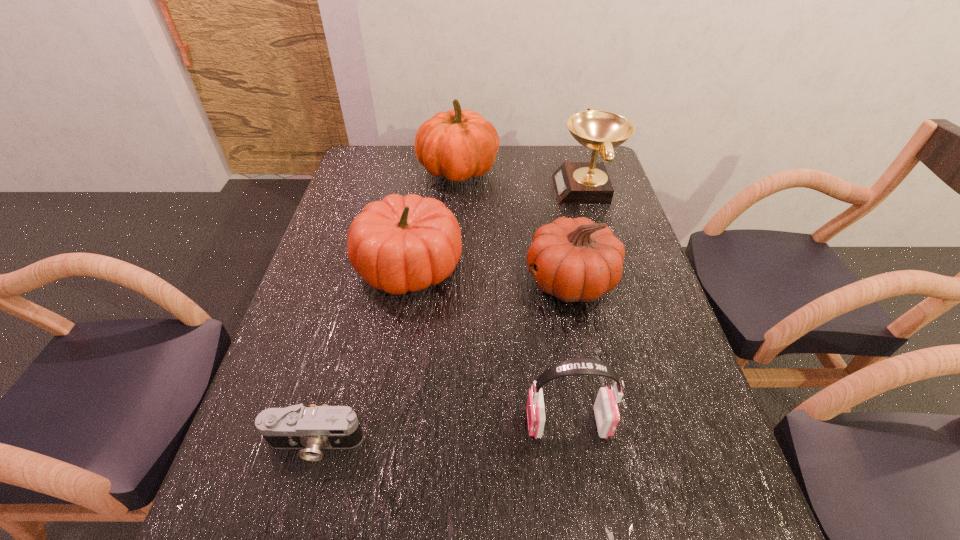
Find the location of a particular element. Image resolution: width=960 pixels, height=540 pixels. the tallest pumpkin is located at coordinates (456, 144).

Locate an element on the screen. This screenshot has width=960, height=540. award is located at coordinates (575, 182).

Find the location of a particular element. The image size is (960, 540). earphone is located at coordinates (607, 416).

Find the location of a particular element. the rightmost pumpkin is located at coordinates (579, 260).

The height and width of the screenshot is (540, 960). In order to click on camera in this screenshot , I will do `click(313, 428)`.

Where is `vacant position located 0.310m on the front of the farthest pumpkin`? vacant position located 0.310m on the front of the farthest pumpkin is located at coordinates (452, 258).

This screenshot has height=540, width=960. I want to click on blank area located 0.200m on the front-facing side of the award, so point(495,190).

Find the location of a particular element. vacant space situated on the front-facing side of the award is located at coordinates (439, 190).

Identify the location of free spot located on the front-facing side of the award. Image resolution: width=960 pixels, height=540 pixels. (477, 190).

At what (x,y) coordinates should I click in order to perform the action: click on free region located 0.250m on the outer surface of the earphone. Please return your answer as a coordinate pair (x, y). Looking at the image, I should click on (403, 423).